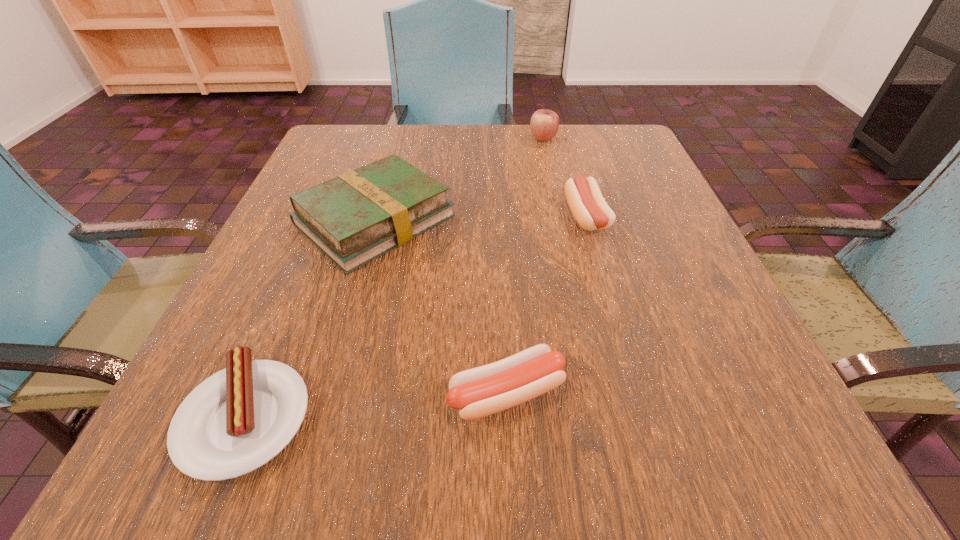
Identify the location of vacant area that lies between the leftmost sausage and the third object from left to right. This screenshot has width=960, height=540. (376, 405).

Find the location of a particular element. free area in between the apple and the fourth shortest object is located at coordinates (459, 179).

The height and width of the screenshot is (540, 960). What are the coordinates of `empty space that is in between the shortest sausage and the book` in the screenshot? It's located at (310, 319).

You are a GUI agent. You are given a task and a screenshot of the screen. Output one action in this format:
    pyautogui.click(x=<x>, y=<y>)
    Task: Click on the free area in between the third object from right to left and the tallest object
    This screenshot has width=960, height=540.
    Given the screenshot: What is the action you would take?
    [525, 266]

Identify the location of the fourth closest object to the second sausage from left to right. (544, 124).

Find the location of a particular element. object that ranks as the second closest to the leftmost sausage is located at coordinates (478, 392).

You are a GUI agent. You are given a task and a screenshot of the screen. Output one action in this format:
    pyautogui.click(x=<x>, y=<y>)
    Task: Click on the sausage that is the second closest one to the rightmost sausage
    The width and height of the screenshot is (960, 540).
    Given the screenshot: What is the action you would take?
    pyautogui.click(x=237, y=420)

What are the coordinates of `sausage identified as the second closest to the fourth shortest object` in the screenshot? It's located at (237, 420).

Where is `free spot that satisfies the following two spatial constraints: 1. on the back side of the rightmost sausage; 2. on the right side of the second sausage from right to left`? free spot that satisfies the following two spatial constraints: 1. on the back side of the rightmost sausage; 2. on the right side of the second sausage from right to left is located at coordinates (498, 218).